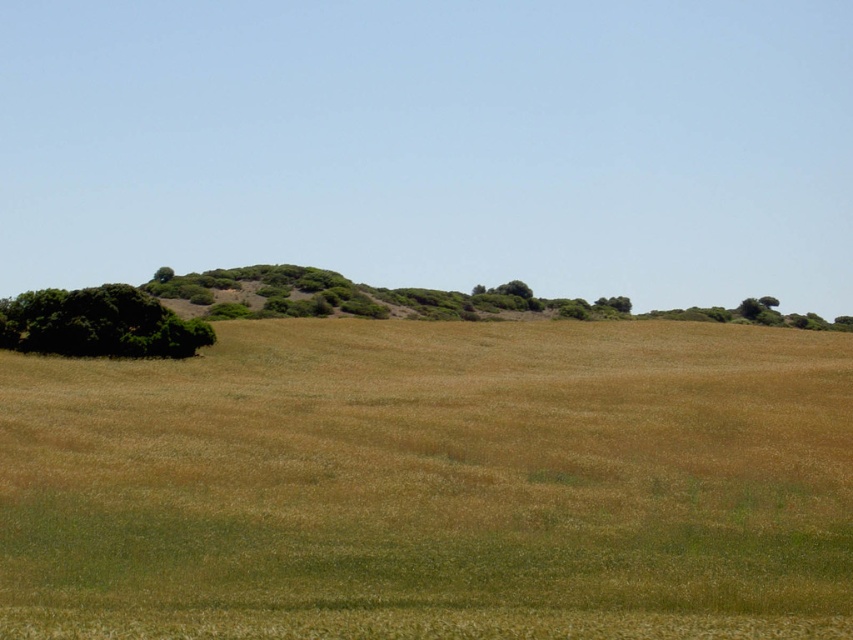
Looking at this image, you are a hiker standing in the middle of the brown grassy field at center and want to reach the green leafy tree at upper left. Which direction should you walk to get there?

The brown grassy field at center is to the right of the green leafy tree at upper left, so you should walk to the left to reach the green leafy tree at upper left.

You are standing at the origin point in the image, which is the bottom left corner. You want to walk to the brown grassy field at center. In which direction should you head?

The brown grassy field at center is located at point (433, 483), so you should head northeast from your current position at the origin point.

You are standing in the middle of the grassland and want to walk towards the two green leafy trees. Which tree will you reach first, the green leafy tree at left or the green leafy tree at upper left?

The green leafy tree at left will be reached first because it is closer to you than the green leafy tree at upper left.